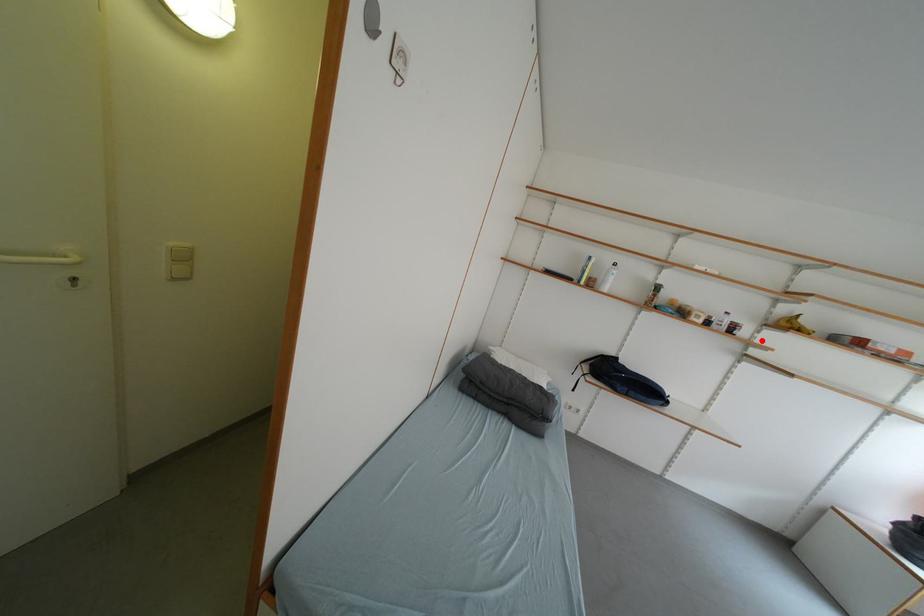
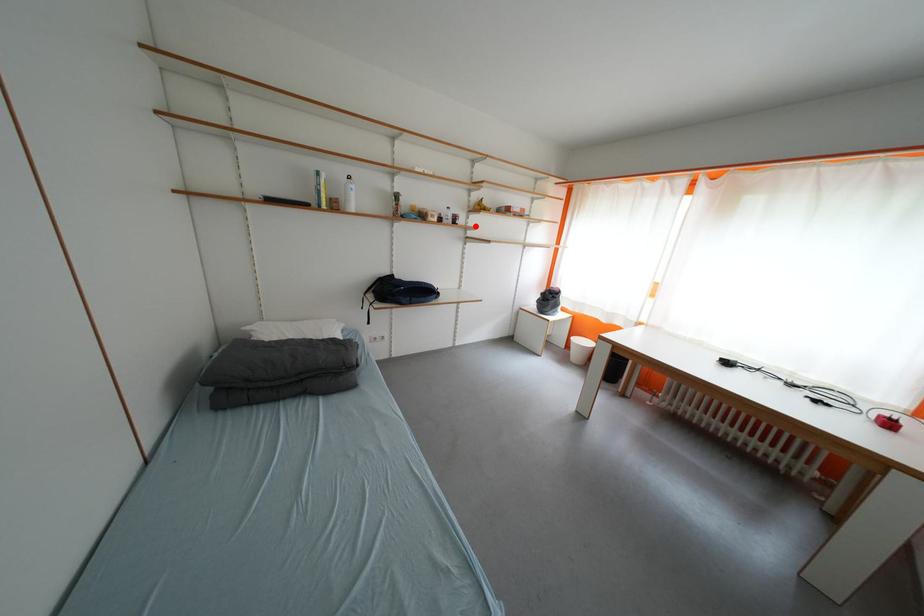
I am providing you with two images of the same scene from different viewpoints. A red point is marked on the first image and another point is marked on the second image. Is the red point in image1 aligned with the point shown in image2?

Yes